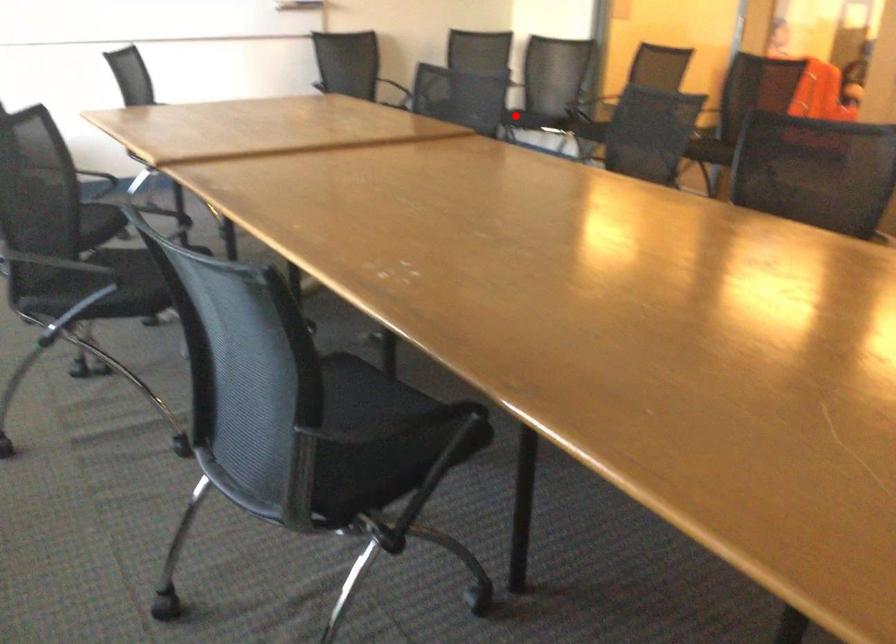
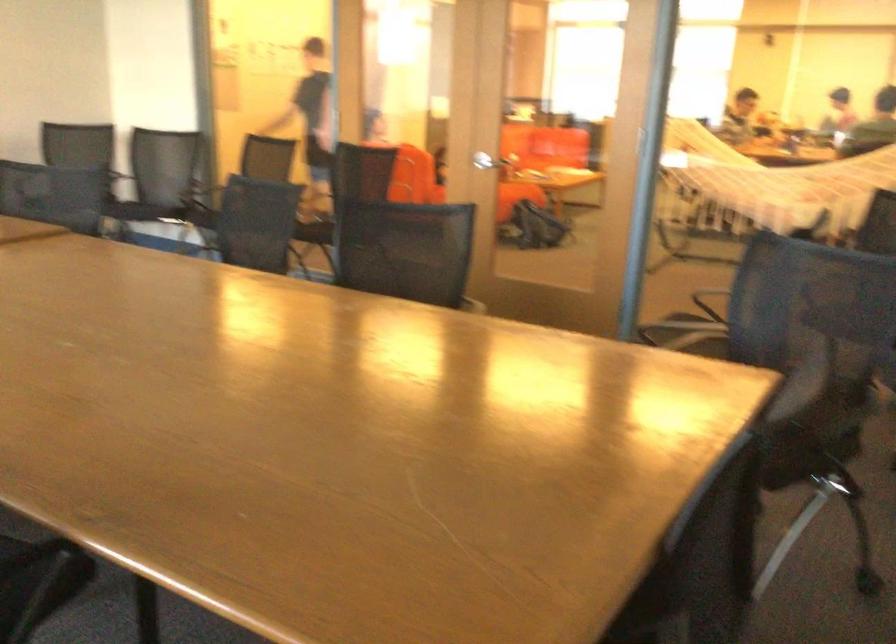
Where in the second image is the point corresponding to the highlighted location from the first image?

(141, 211)